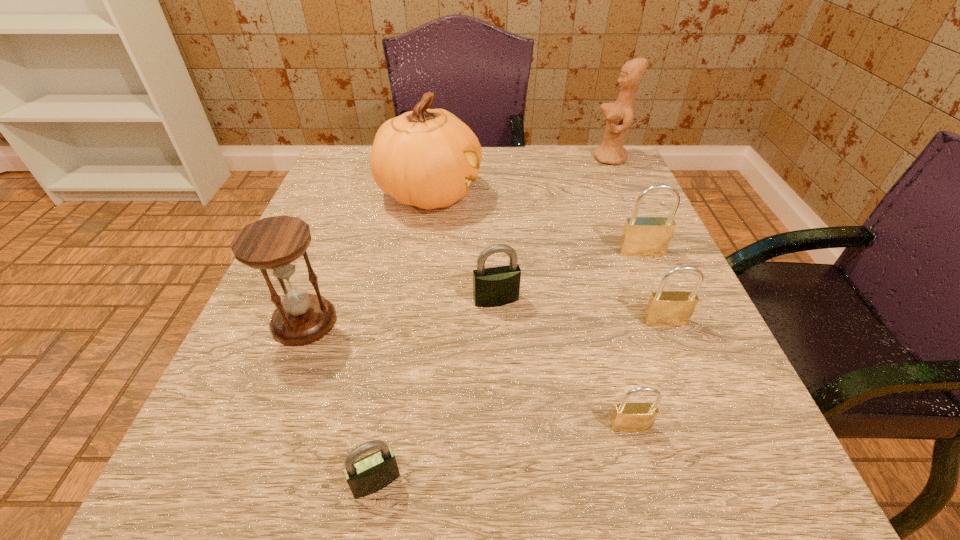
At what (x,y) coordinates should I click in order to perform the action: click on free space between the farthest padlock and the pumpkin. Please return your answer as a coordinate pair (x, y). Image resolution: width=960 pixels, height=540 pixels. Looking at the image, I should click on (536, 223).

This screenshot has height=540, width=960. I want to click on free space between the figurine and the farther black padlock, so click(553, 229).

Image resolution: width=960 pixels, height=540 pixels. What are the coordinates of `empty space between the pumpkin and the second nearest object` in the screenshot? It's located at (530, 310).

This screenshot has height=540, width=960. I want to click on vacant area between the second nearest object and the fourth tallest object, so click(x=636, y=339).

Where is `vacant area that lies between the fourth padlock from right to left and the biggest brass padlock`? vacant area that lies between the fourth padlock from right to left and the biggest brass padlock is located at coordinates (568, 276).

This screenshot has width=960, height=540. What are the coordinates of `blank region between the right black padlock and the figurine` in the screenshot? It's located at (553, 229).

Locate which object is the second closest to the nearest padlock. Please provide its 2D coordinates. Your answer should be formatted as a tuple, i.e. [(x, y)], where the tuple contains the x and y coordinates of a point satisfying the conditions above.

[(627, 417)]

Locate which object ranks fifth in proximity to the pumpkin. Please provide its 2D coordinates. Your answer should be formatted as a tuple, i.e. [(x, y)], where the tuple contains the x and y coordinates of a point satisfying the conditions above.

[(665, 308)]

You are a GUI agent. You are given a task and a screenshot of the screen. Output one action in this format:
    pyautogui.click(x=<x>, y=<y>)
    Task: Click on the padlock that is the nearest to the second smallest brass padlock
    The height and width of the screenshot is (540, 960).
    Given the screenshot: What is the action you would take?
    pyautogui.click(x=642, y=236)

I want to click on the closest padlock to the third nearest padlock, so click(642, 236).